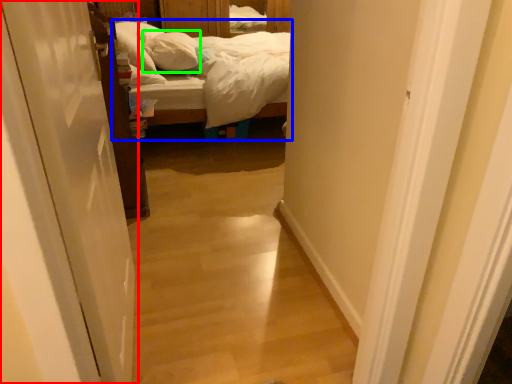
Question: Estimate the real-world distances between objects in this image. Which object is closer to door (highlighted by a red box), bed (highlighted by a blue box) or pillow (highlighted by a green box)?

Choices:
 (A) bed
 (B) pillow

Answer: (A)